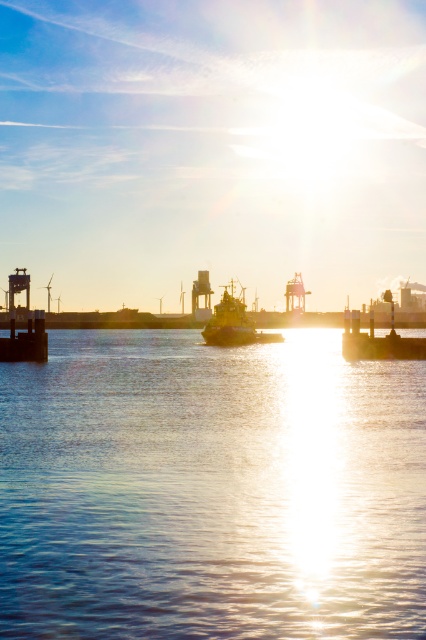
You are a photographer trying to capture the reflection of the shiny metallic tugboat at center in the glistening water at center. Based on the scene description, will the reflection be visible? Explain your reasoning.

The glistening water at center has a lesser height compared to shiny metallic tugboat at center. Since the water is lower than the tugboat, the reflection might not be fully visible or could appear distorted because the water level is below the boat.

You are standing on the dock and looking at the scene. Which object is closer to you between the glistening water at center and the shiny metallic tugboat at center?

The glistening water at center is closer to the viewer than the shiny metallic tugboat at center.